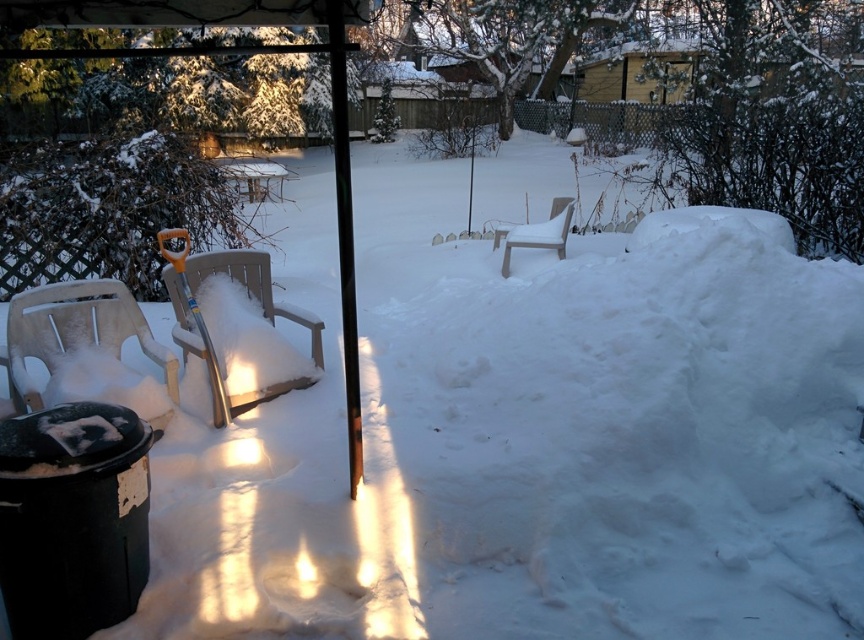
Question: Which object is positioned closest to the wooden chair at center-left?

Choices:
 (A) teal plastic shovel at center
 (B) plastic chair at left
 (C) white plastic chair at center

Answer: (A)

Question: From the image, what is the correct spatial relationship of wooden chair at center-left in relation to plastic chair at left?

Choices:
 (A) above
 (B) below

Answer: (A)

Question: Does wooden chair at center-left appear on the left side of teal plastic shovel at center?

Choices:
 (A) no
 (B) yes

Answer: (A)

Question: Among these objects, which one is nearest to the camera?

Choices:
 (A) teal plastic shovel at center
 (B) white plastic chair at center
 (C) plastic chair at left

Answer: (C)

Question: Which of the following is the farthest from the observer?

Choices:
 (A) (178, 269)
 (B) (18, 342)

Answer: (A)

Question: Is plastic chair at left wider than white plastic chair at center?

Choices:
 (A) yes
 (B) no

Answer: (A)